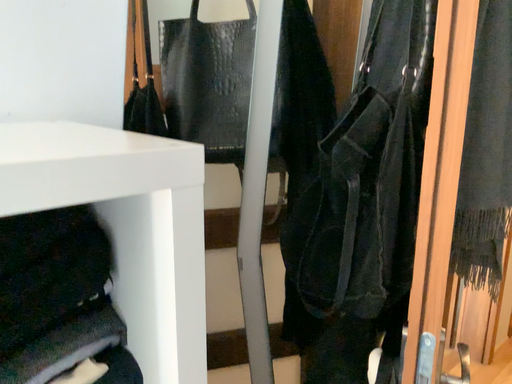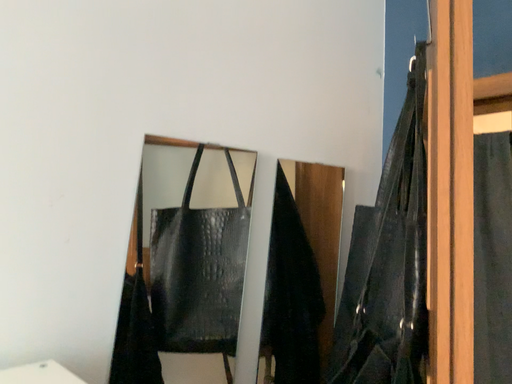
Question: How did the camera likely rotate when shooting the video?

Choices:
 (A) rotated downward
 (B) rotated upward

Answer: (B)